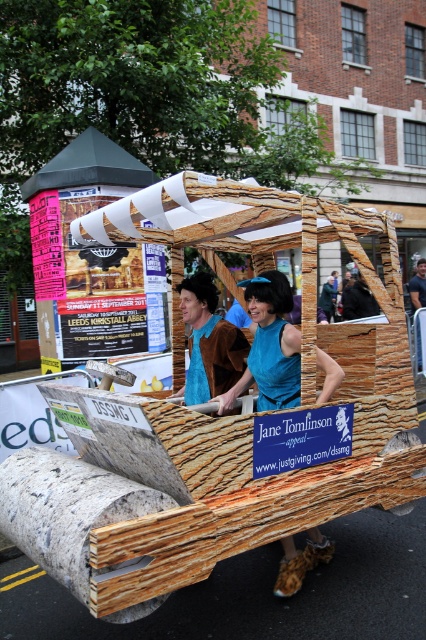
Question: Among these objects, which one is nearest to the camera?

Choices:
 (A) teal fabric dress at center
 (B) blue fabric at center
 (C) brown leather jacket at center
 (D) wooden cart at center

Answer: (D)

Question: Considering the real-world distances, which object is farthest from the blue fabric at center?

Choices:
 (A) brown leather jacket at center
 (B) wooden cart at center
 (C) teal fabric dress at center

Answer: (A)

Question: Which point is farther to the camera?

Choices:
 (A) teal fabric dress at center
 (B) wooden cart at center
 (C) brown leather jacket at center

Answer: (C)

Question: Can you confirm if wooden cart at center is bigger than blue fabric at center?

Choices:
 (A) no
 (B) yes

Answer: (B)

Question: Can you confirm if teal fabric dress at center is bigger than blue fabric at center?

Choices:
 (A) no
 (B) yes

Answer: (B)

Question: Where is blue fabric at center located in relation to brown leather jacket at center in the image?

Choices:
 (A) below
 (B) above

Answer: (A)